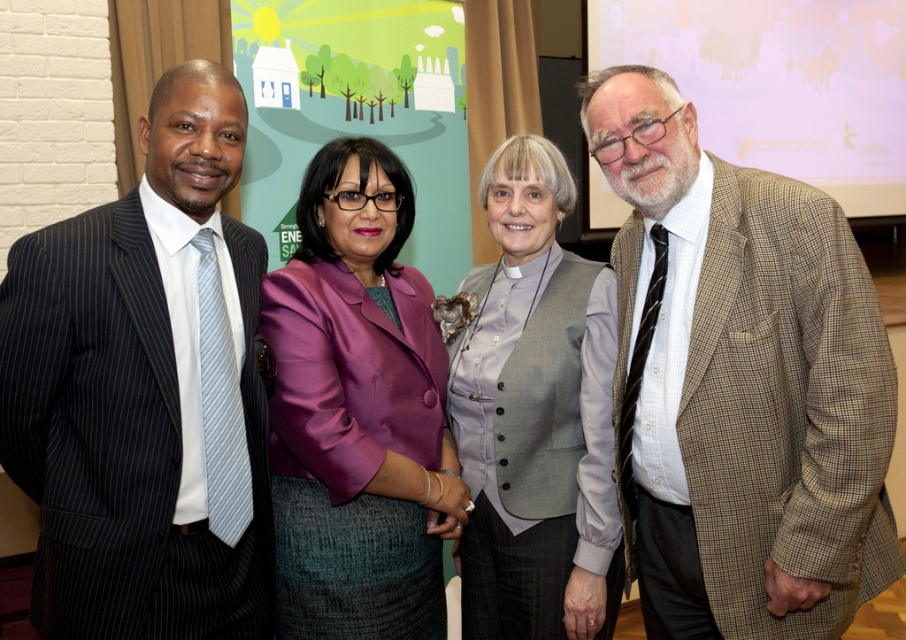
Which clothing item is closer to the viewer between the purple satin blazer at center and the gray buttoned vest at center?

The purple satin blazer at center is closer to the viewer than the gray buttoned vest at center.